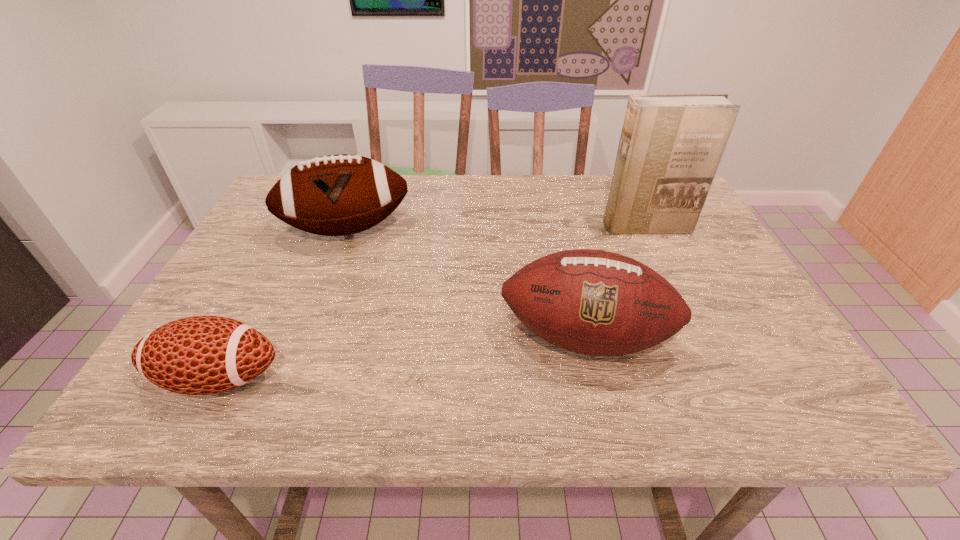
Locate an element on the screen. The width and height of the screenshot is (960, 540). phonebook is located at coordinates (670, 147).

At what (x,y) coordinates should I click in order to perform the action: click on the farthest football. Please return your answer as a coordinate pair (x, y). Looking at the image, I should click on click(x=336, y=195).

At what (x,y) coordinates should I click in order to perform the action: click on the rightmost football. Please return your answer as a coordinate pair (x, y). The width and height of the screenshot is (960, 540). Looking at the image, I should click on (593, 302).

The height and width of the screenshot is (540, 960). In order to click on the shortest football in this screenshot , I will do 200,355.

Locate an element on the screen. blank space located 0.310m on the cover of the phonebook is located at coordinates (691, 323).

I want to click on vacant space located on the front of the farthest football, so click(x=315, y=314).

The height and width of the screenshot is (540, 960). I want to click on blank space located on the left of the rightmost football, so click(x=344, y=337).

Image resolution: width=960 pixels, height=540 pixels. I want to click on free region located on the back of the shortest football, so click(253, 313).

Locate an element on the screen. object positioned at the far edge is located at coordinates (336, 195).

Identify the location of object positioned at the right edge. (670, 147).